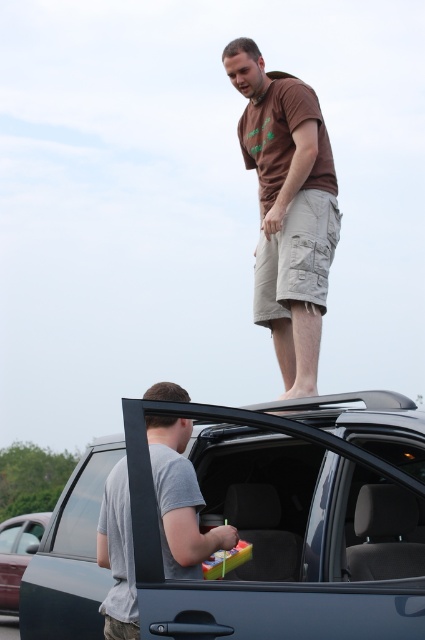
Question: Which object is the closest to the metallic gray car door at lower left?

Choices:
 (A) matte gray suv at center
 (B) gray matte plastic bag at center
 (C) brown cotton t-shirt at upper center

Answer: (C)

Question: Can you confirm if matte gray suv at center is positioned above brown cotton t-shirt at upper center?

Choices:
 (A) yes
 (B) no

Answer: (B)

Question: Which point is closer to the camera taking this photo?

Choices:
 (A) (31, 538)
 (B) (110, 481)

Answer: (B)

Question: Does gray matte plastic bag at center have a greater width compared to metallic gray car door at lower left?

Choices:
 (A) no
 (B) yes

Answer: (A)

Question: Does matte gray suv at center lie behind brown cotton t-shirt at upper center?

Choices:
 (A) no
 (B) yes

Answer: (A)

Question: Which of the following is the farthest from the observer?

Choices:
 (A) matte gray suv at center
 (B) metallic gray car door at lower left
 (C) brown cotton t-shirt at upper center

Answer: (B)